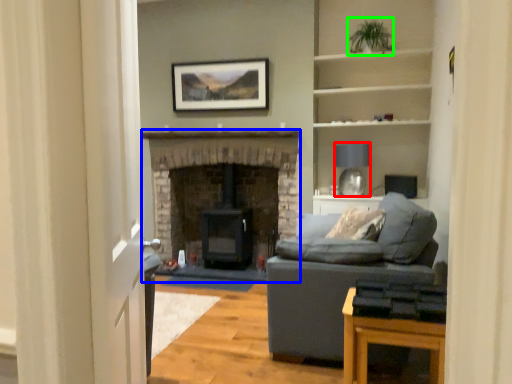
Question: Which object is positioned farthest from lamp (highlighted by a red box)? Select from fireplace (highlighted by a blue box) and plant (highlighted by a green box).

Choices:
 (A) fireplace
 (B) plant

Answer: (B)